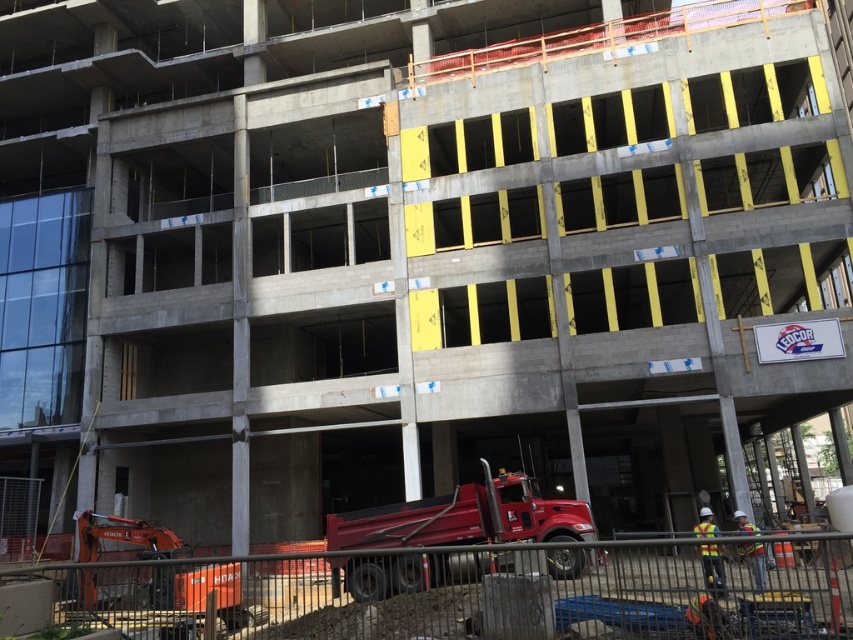
Question: Can you confirm if shiny red truck at center is wider than reflective yellow safety vest at lower center?

Choices:
 (A) yes
 (B) no

Answer: (A)

Question: Can you confirm if reflective yellow safety vest at lower center is positioned above reflective safety vest at center?

Choices:
 (A) yes
 (B) no

Answer: (B)

Question: Which point appears closest to the camera in this image?

Choices:
 (A) (718, 566)
 (B) (755, 554)

Answer: (A)

Question: Which object is farther from the camera taking this photo?

Choices:
 (A) shiny red truck at center
 (B) reflective safety vest at center

Answer: (B)

Question: Can you confirm if shiny red truck at center is positioned to the right of reflective yellow safety vest at lower center?

Choices:
 (A) yes
 (B) no

Answer: (B)

Question: Which point appears farthest from the camera in this image?

Choices:
 (A) (749, 560)
 (B) (566, 502)
 (C) (703, 548)

Answer: (B)